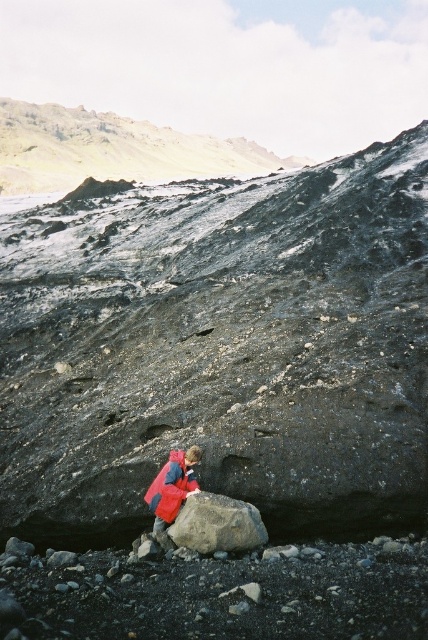
Question: Is smooth gray rock at center positioned in front of red matte jacket at center?

Choices:
 (A) no
 (B) yes

Answer: (A)

Question: Considering the relative positions of smooth gray rock at center and dark gray rocky cliff at upper center in the image provided, where is smooth gray rock at center located with respect to dark gray rocky cliff at upper center?

Choices:
 (A) above
 (B) below

Answer: (B)

Question: Which point appears farthest from the camera in this image?

Choices:
 (A) (155, 515)
 (B) (418, 436)

Answer: (B)

Question: Is smooth gray rock at center further to the viewer compared to dark gray rocky cliff at upper center?

Choices:
 (A) yes
 (B) no

Answer: (B)

Question: Among these points, which one is nearest to the camera?

Choices:
 (A) (12, 144)
 (B) (213, 531)
 (C) (83, 488)
 (D) (165, 522)

Answer: (B)

Question: Which object is farther from the camera taking this photo?

Choices:
 (A) dark gray rocky cliff at upper center
 (B) gray rough rock at center
 (C) red matte jacket at center
 (D) smooth gray rock at center

Answer: (A)